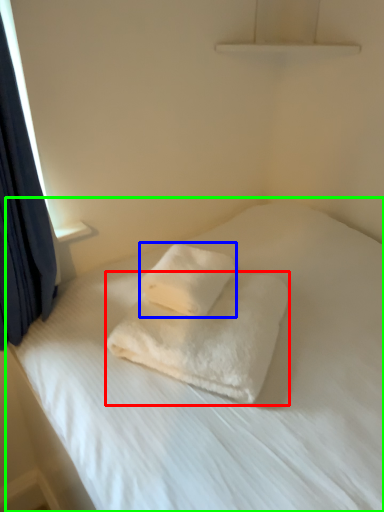
Question: Estimate the real-world distances between objects in this image. Which object is farther from towel (highlighted by a red box), towel (highlighted by a blue box) or bed (highlighted by a green box)?

Choices:
 (A) towel
 (B) bed

Answer: (B)